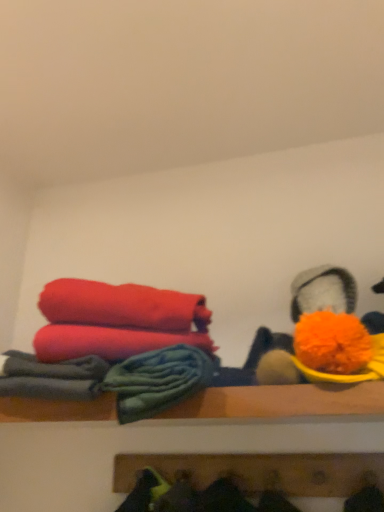
Identify the location of vacant region under matte red towel at left (from a real-world perspective). The width and height of the screenshot is (384, 512). (107, 353).